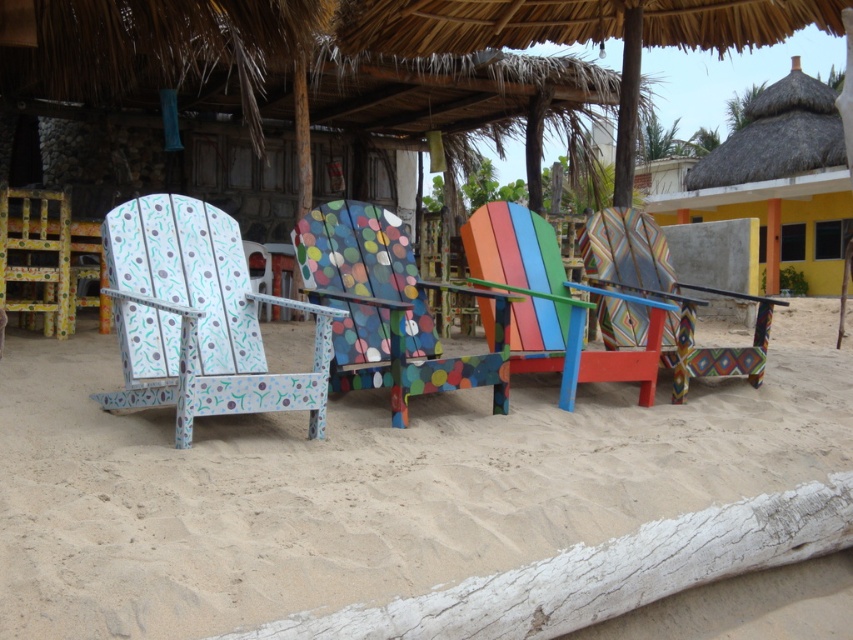
You are a delivery drone carrying a package that requires a minimum clearance of 20 meters between the drop zone and any obstacles. You need to deliver the package to the area near the matte painted wood chair at left. Is the thatched roof hut at upper right within the required safety distance?

The matte painted wood chair at left and thatched roof hut at upper right are 21.78 meters apart. Since the required minimum clearance is 20 meters, the distance is sufficient, so the thatched roof hut at upper right is outside the required safety zone.

You are a photographer standing on the sandy beach at lower center and want to take a photo of the multicolored painted chair at center. Based on their positions, will the chair be visible in your photo if you point your camera straight ahead?

The sandy beach at lower center is positioned under the multicolored painted chair at center, so if you point your camera straight ahead while standing on the sandy beach at lower center, the multicolored painted chair at center will be visible in your photo because it is directly above your position.